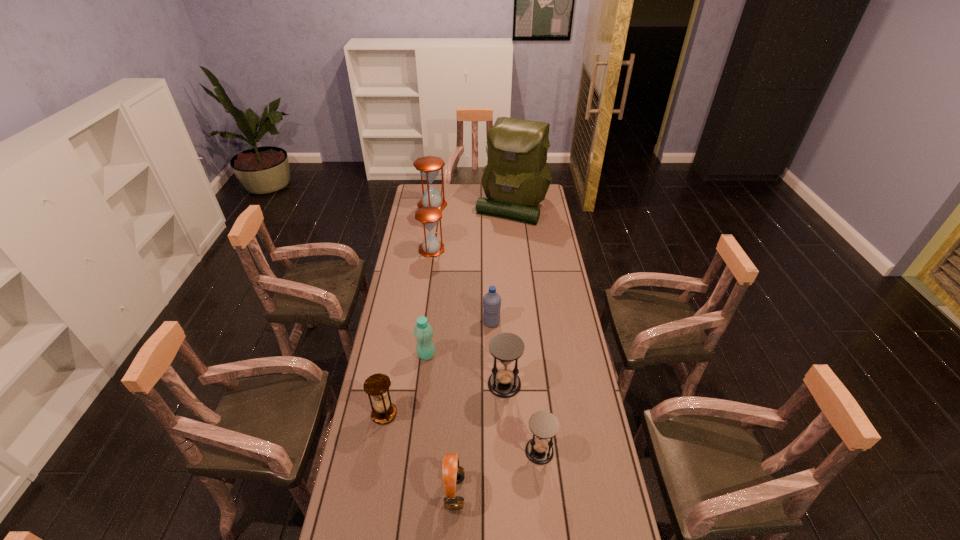
Identify the location of vacant area that lies between the farthest brown hourglass and the fourth nearest object. (468, 294).

Image resolution: width=960 pixels, height=540 pixels. I want to click on vacant region between the second farthest hourglass and the green backpack, so click(x=471, y=228).

You are a GUI agent. You are given a task and a screenshot of the screen. Output one action in this format:
    pyautogui.click(x=<x>, y=<y>)
    Task: Click on the empty space that is in between the water bottle and the tallest object
    Image resolution: width=960 pixels, height=540 pixels.
    Given the screenshot: What is the action you would take?
    pyautogui.click(x=502, y=264)

This screenshot has width=960, height=540. Identify the location of empty location between the second biggest brown hourglass and the backpack. (471, 228).

At what (x,y) coordinates should I click in order to perform the action: click on unoccupied area between the eighth shortest object and the water bottle. Please return your answer as a coordinate pair (x, y). Looking at the image, I should click on (462, 264).

Find the location of a particular element. This screenshot has height=540, width=960. object identified as the eighth closest to the eighth shortest object is located at coordinates (453, 473).

In order to click on object that is the second closest to the biggest brown hourglass in this screenshot , I will do `click(428, 216)`.

Locate which hourglass ranks in proximity to the fifth farthest object. Please provide its 2D coordinates. Your answer should be formatted as a tuple, i.e. [(x, y)], where the tuple contains the x and y coordinates of a point satisfying the conditions above.

[(377, 386)]

The image size is (960, 540). Identify the location of the closest hourglass to the green backpack. (429, 166).

Choose which brown hourglass is the nearest neighbor to the sixth farthest object. Please provide its 2D coordinates. Your answer should be formatted as a tuple, i.e. [(x, y)], where the tuple contains the x and y coordinates of a point satisfying the conditions above.

[(377, 386)]